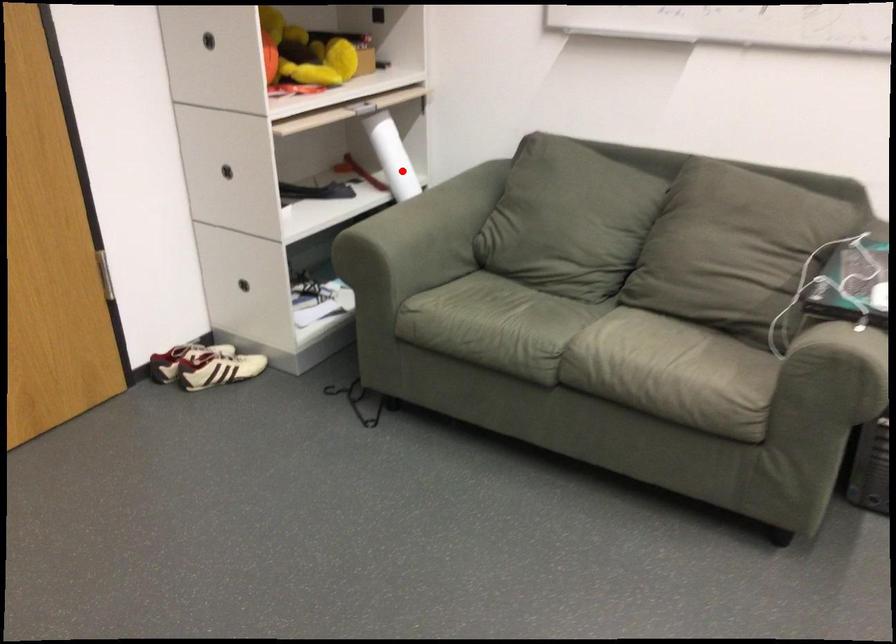
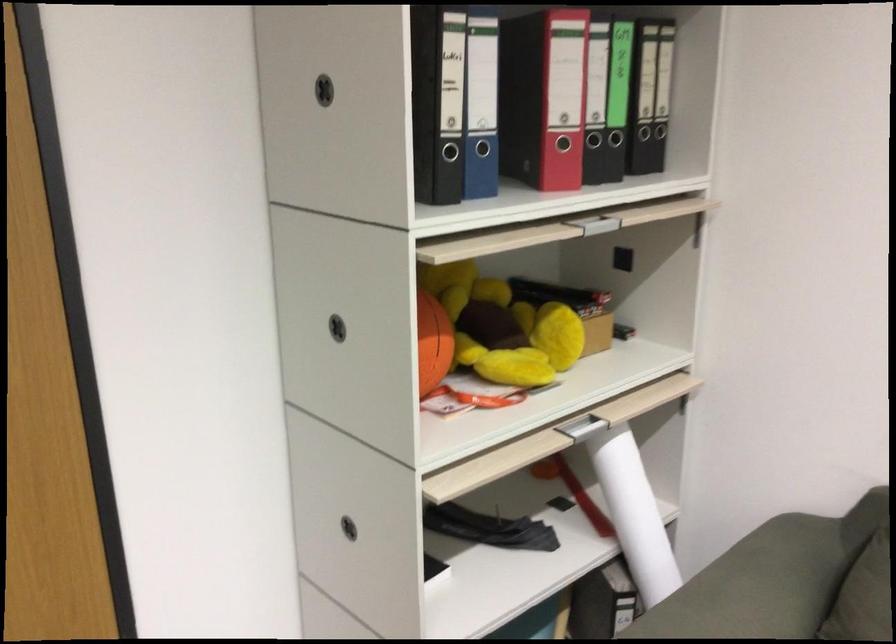
Where in the second image is the point corresponding to the highlighted location from the first image?

(633, 514)